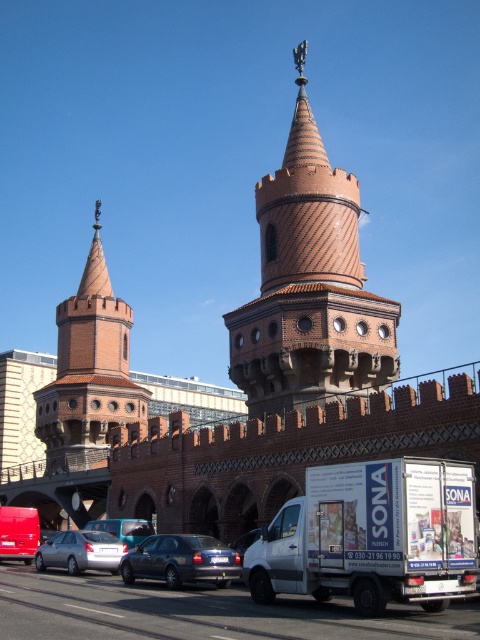
Who is taller, brown textured tower at center or metallic silver van at center?

brown textured tower at center

Can you confirm if brown textured tower at center is taller than metallic silver van at center?

Yes.

Between point (357, 237) and point (139, 531), which one is positioned behind?

The point (357, 237) is more distant.

The width and height of the screenshot is (480, 640). I want to click on brown textured tower at center, so click(x=310, y=285).

Does white matte van at lower right have a smaller size compared to brick stonework tower at left?

Yes.

Who is more distant from viewer, (368, 540) or (73, 454)?

The point (73, 454) is behind.

You are a GUI agent. You are given a task and a screenshot of the screen. Output one action in this format:
    pyautogui.click(x=<x>, y=<y>)
    Task: Click on the white matte van at lower right
    The width and height of the screenshot is (480, 640).
    Given the screenshot: What is the action you would take?
    pyautogui.click(x=372, y=536)

Which of these two, matte red van at lower left or metallic silver sedan at center, stands shorter?

metallic silver sedan at center is shorter.

Can you confirm if matte red van at lower left is positioned above metallic silver sedan at center?

Actually, matte red van at lower left is below metallic silver sedan at center.

In order to click on matte red van at lower left in this screenshot , I will do `click(19, 532)`.

You are a GUI agent. You are given a task and a screenshot of the screen. Output one action in this format:
    pyautogui.click(x=<x>, y=<y>)
    Task: Click on the matte red van at lower left
    This screenshot has height=640, width=480.
    Given the screenshot: What is the action you would take?
    pyautogui.click(x=19, y=532)